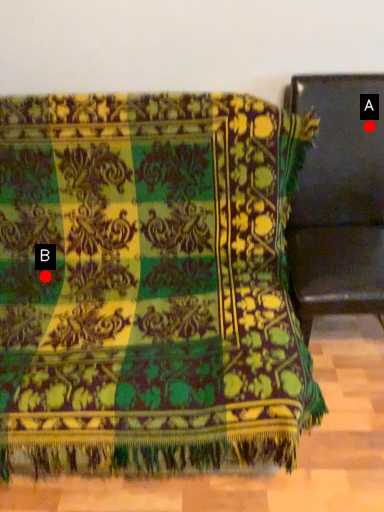
Question: Two points are circled on the image, labeled by A and B beside each circle. Which point is farther from the camera taking this photo?

Choices:
 (A) A is further
 (B) B is further

Answer: (A)